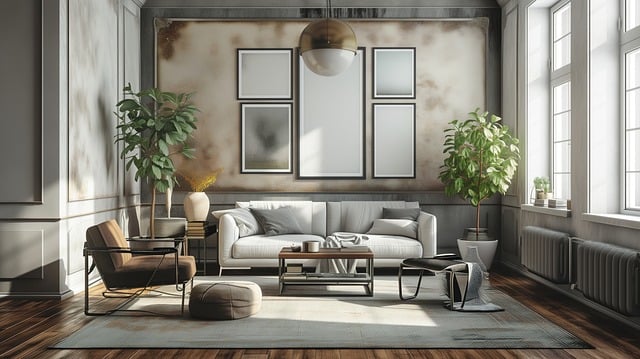
Image resolution: width=640 pixels, height=359 pixels. What are the coordinates of `rug` in the screenshot? It's located at (347, 321).